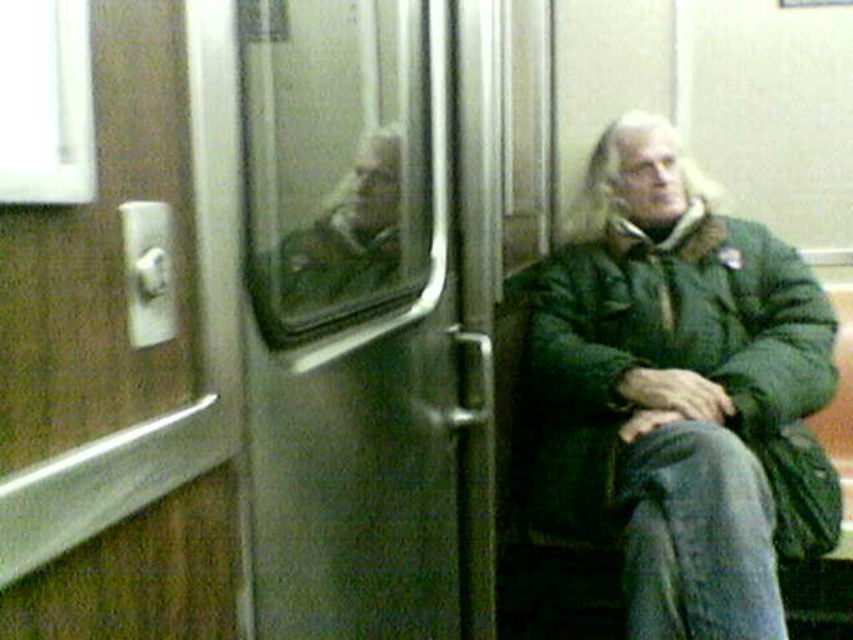
You are standing in the subway car and want to approach both the green fuzzy jacket at right and the green fabric jacket at center. Which jacket should you move towards first to reach the one closer to you?

You should move towards the green fuzzy jacket at right first because it is closer to you compared to the green fabric jacket at center, which is farther away.

You are a passenger in a subway car and want to place a 1 meter long backpack between the green fuzzy jacket at right and the green fabric jacket at center. Can you fit the backpack between them?

The distance between the green fuzzy jacket at right and the green fabric jacket at center is 85.31 centimeters. Since the backpack is 1 meter long, which is longer than the available space, it won